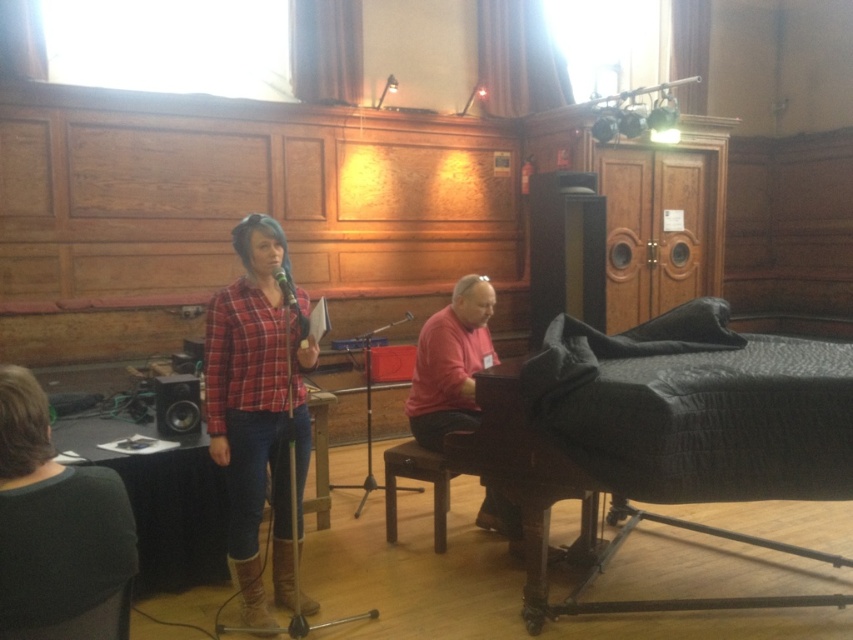
Between plaid shirt at center and pink matte shirt at center, which one is positioned higher?

pink matte shirt at center is above.

What do you see at coordinates (251, 412) in the screenshot? The height and width of the screenshot is (640, 853). I see `plaid shirt at center` at bounding box center [251, 412].

Who is more forward, [222,365] or [459,406]?

Point [222,365] is in front.

I want to click on plaid shirt at center, so click(251, 412).

Which is more to the right, black textured piano at right or pink matte shirt at center?

Positioned to the right is black textured piano at right.

Between point (680, 520) and point (473, 360), which one is positioned behind?

The point (680, 520) is behind.

Which is in front, point (524, 451) or point (440, 417)?

Point (524, 451) is more forward.

The width and height of the screenshot is (853, 640). In order to click on black textured piano at right in this screenshot , I will do `click(556, 500)`.

Is plaid shirt at center to the left of black textured piano at right from the viewer's perspective?

Yes, plaid shirt at center is to the left of black textured piano at right.

Between point (236, 532) and point (584, 541), which one is positioned behind?

Point (584, 541)

Locate an element on the screen. The image size is (853, 640). plaid shirt at center is located at coordinates (251, 412).